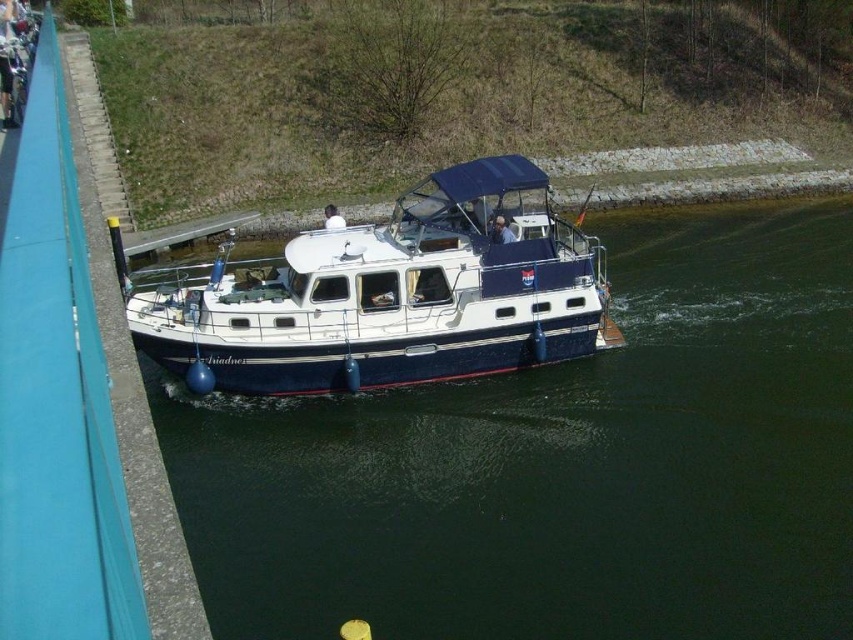
Can you confirm if dark blue water at center is smaller than blue polished wood boat at center?

Incorrect, dark blue water at center is not smaller in size than blue polished wood boat at center.

Looking at this image, is the position of dark blue water at center more distant than that of blue polished wood boat at center?

No, dark blue water at center is in front of blue polished wood boat at center.

Does point (624, 586) lie in front of point (527, 337)?

That is True.

I want to click on dark blue water at center, so click(x=561, y=465).

Measure the distance between blue polished wood boat at center and matte white shirt at center.

blue polished wood boat at center and matte white shirt at center are 7.58 feet apart from each other.

Between point (358, 372) and point (498, 218), which one is positioned in front?

Positioned in front is point (358, 372).

Looking at this image, who is more forward, (428, 346) or (500, 228)?

Positioned in front is point (428, 346).

You are a GUI agent. You are given a task and a screenshot of the screen. Output one action in this format:
    pyautogui.click(x=<x>, y=<y>)
    Task: Click on the blue polished wood boat at center
    
    Given the screenshot: What is the action you would take?
    pyautogui.click(x=390, y=296)

Is blue polished wood boat at center to the left of white fabric person at center from the viewer's perspective?

Incorrect, blue polished wood boat at center is not on the left side of white fabric person at center.

The width and height of the screenshot is (853, 640). What do you see at coordinates (390, 296) in the screenshot? I see `blue polished wood boat at center` at bounding box center [390, 296].

At what (x,y) coordinates should I click in order to perform the action: click on blue polished wood boat at center. Please return your answer as a coordinate pair (x, y). Looking at the image, I should click on (390, 296).